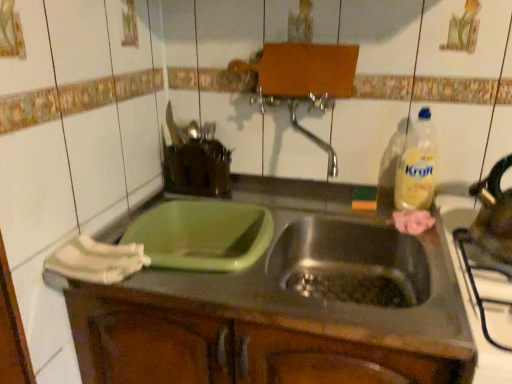
Question: Does stainless steel kettle at right appear on the left side of shiny metallic tea pot at right?

Choices:
 (A) yes
 (B) no

Answer: (A)

Question: From a real-world perspective, does stainless steel kettle at right stand above shiny metallic tea pot at right?

Choices:
 (A) no
 (B) yes

Answer: (A)

Question: From a real-world perspective, is stainless steel kettle at right below shiny metallic tea pot at right?

Choices:
 (A) no
 (B) yes

Answer: (B)

Question: Is stainless steel kettle at right beside shiny metallic tea pot at right?

Choices:
 (A) no
 (B) yes

Answer: (A)

Question: Is stainless steel kettle at right positioned with its back to shiny metallic tea pot at right?

Choices:
 (A) yes
 (B) no

Answer: (B)

Question: Would you say stainless steel kettle at right is a long distance from shiny metallic tea pot at right?

Choices:
 (A) no
 (B) yes

Answer: (A)

Question: Can you confirm if yellow plastic bottle at right is smaller than green plastic container at center-left?

Choices:
 (A) yes
 (B) no

Answer: (A)

Question: Is yellow plastic bottle at right completely or partially outside of green plastic container at center-left?

Choices:
 (A) no
 (B) yes

Answer: (B)

Question: From a real-world perspective, does yellow plastic bottle at right sit lower than green plastic container at center-left?

Choices:
 (A) no
 (B) yes

Answer: (A)

Question: Is the surface of yellow plastic bottle at right in direct contact with green plastic container at center-left?

Choices:
 (A) no
 (B) yes

Answer: (A)

Question: Considering the relative positions of yellow plastic bottle at right and green plastic container at center-left in the image provided, is yellow plastic bottle at right in front of green plastic container at center-left?

Choices:
 (A) yes
 (B) no

Answer: (B)

Question: Does yellow plastic bottle at right have a greater height compared to green plastic container at center-left?

Choices:
 (A) yes
 (B) no

Answer: (A)

Question: Does shiny metallic tea pot at right have a larger size compared to green plastic container at center-left?

Choices:
 (A) yes
 (B) no

Answer: (B)